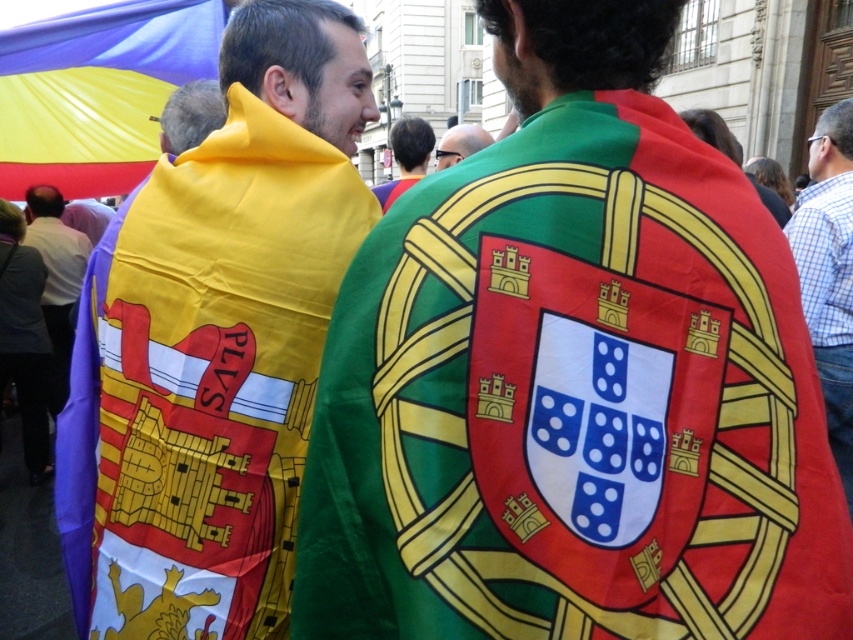
You are a fashion designer observing a street scene. You notice two accessories worn by people in the image. The first is the matte yellow scarf at left, and the second is the green fabric headscarf at center. Which of these two accessories is shorter in length?

The matte yellow scarf at left is shorter than the green fabric headscarf at center.

You are a photographer trying to capture both the blue checkered shirt at right and the green fabric headscarf at center in a single frame. Which object should you focus on first to ensure both are in the frame?

The blue checkered shirt at right is smaller than the green fabric headscarf at center, so you should focus on the green fabric headscarf at center first to ensure both fit within the frame.